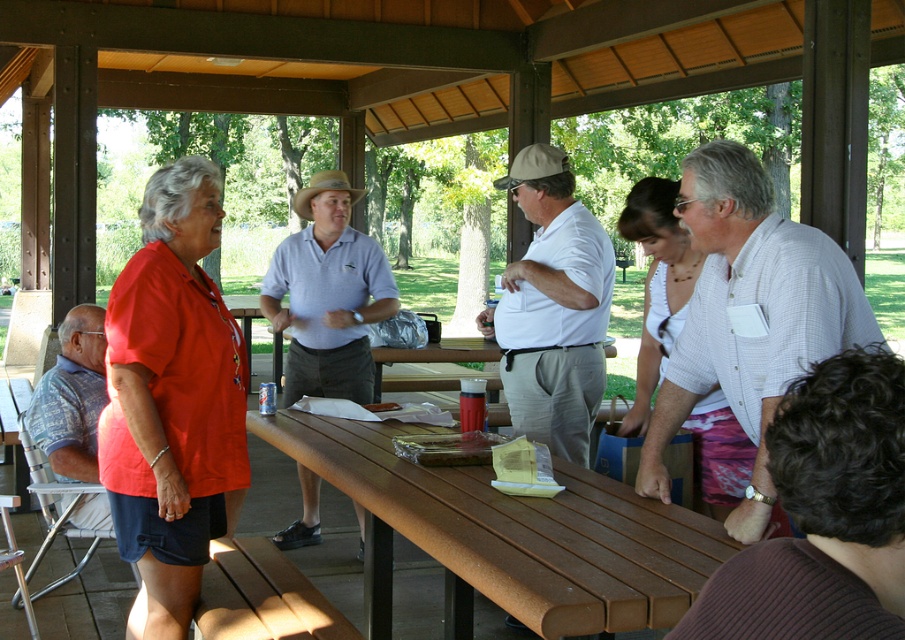
You are a person with a 36 inch wide backpack. You are standing at the edge of the brown wood picnic table at center and want to walk towards the matte white shirt at center. Can your backpack fit through the space between the table and the shirt?

The brown wood picnic table at center is 38.50 inches away from matte white shirt at center. Since your backpack is 36 inches wide, it can fit through the space as the distance is greater than the backpack width.

You are at the park and want to sit down at the brown wood picnic table at center. There is a person wearing a matte white shirt at center in your way. Which direction should you move to reach the table without disturbing them?

You should move to your left since the brown wood picnic table at center is to the left of the matte white shirt at center, so moving left will allow you to reach the table without disturbing the person.

You are a photographer trying to capture a group photo of the matte white shirt at center and the blue patterned shirt at left. Based on their positions and sizes, which person should you position closer to the camera to ensure both appear equally sized in the photo?

The matte white shirt at center has a lesser width compared to the blue patterned shirt at left, so to make them appear equally sized in the photo, you should position the matte white shirt at center closer to the camera than the blue patterned shirt at left.